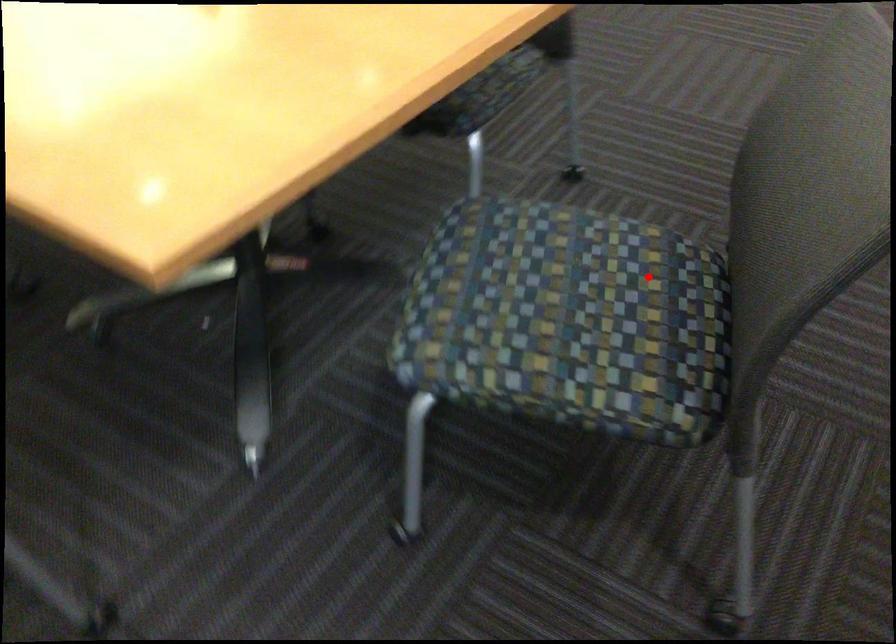
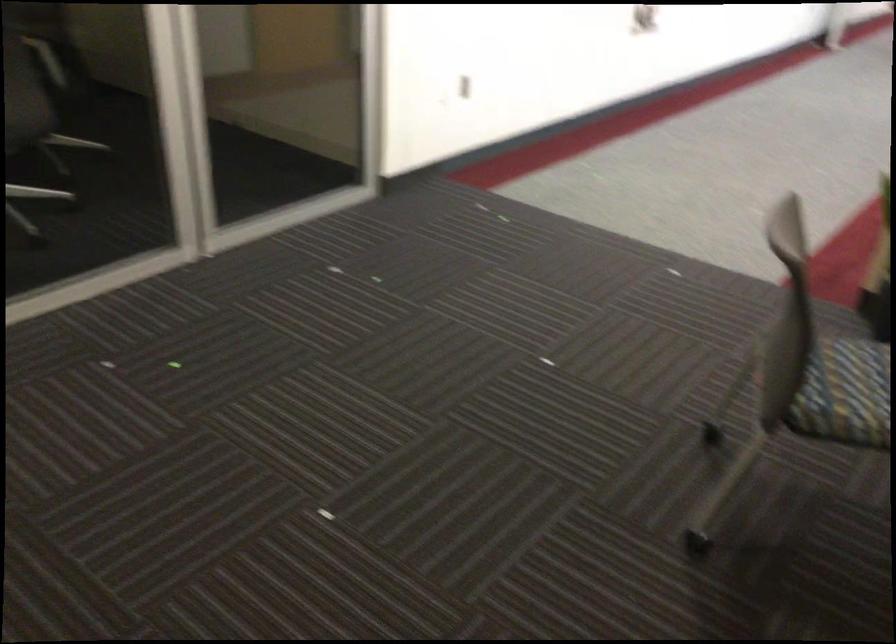
Question: I am providing you with two images of the same scene from different viewpoints. Image1 has a red point marked. In image2, the corresponding 3D location appears at what relative position? Reply with the corresponding letter.

Choices:
 (A) Closer
 (B) Farther

Answer: (B)